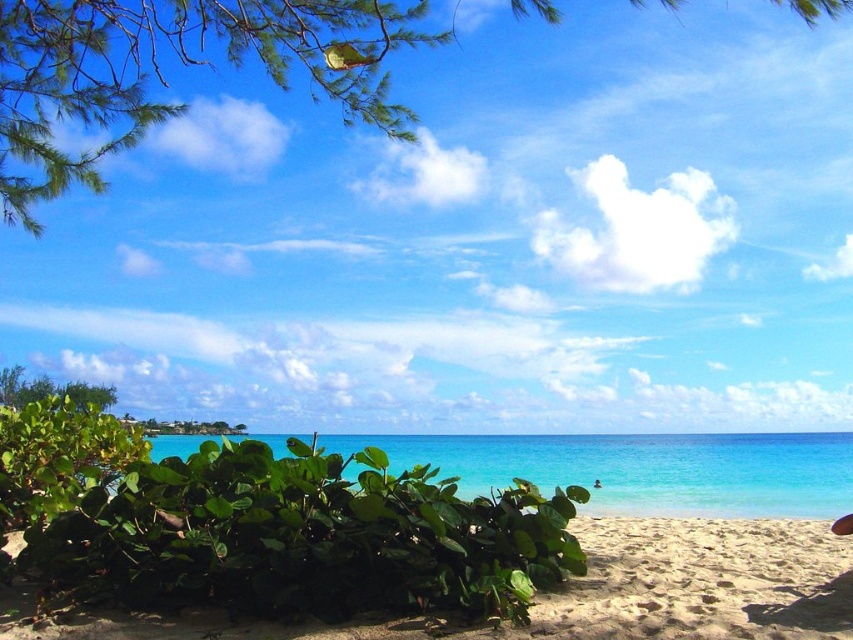
You are a photographer trying to capture the green leafy bush at center and the turquoise glossy water at center in the same frame. Based on their sizes in the image, which object would appear smaller in the photo?

The green leafy bush at center appears smaller in the photo because it is shorter than the turquoise glossy water at center.

You are standing on the sandy beach at lower right and want to reach the turquoise glossy water at center. How many steps do you think you need to take to reach the water?

The sandy beach at lower right is closer to the viewer than the turquoise glossy water at center, so you need to take a few steps forward to reach the water.